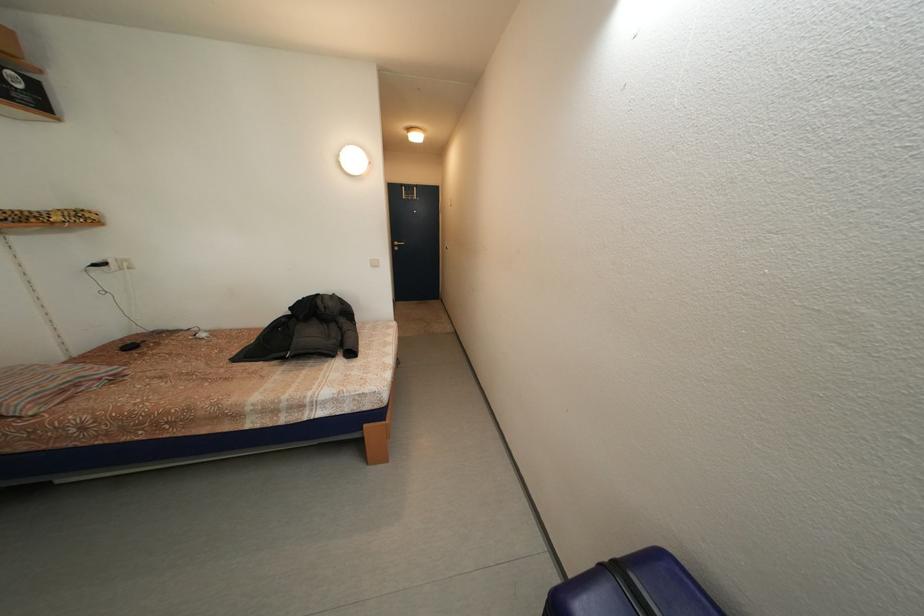
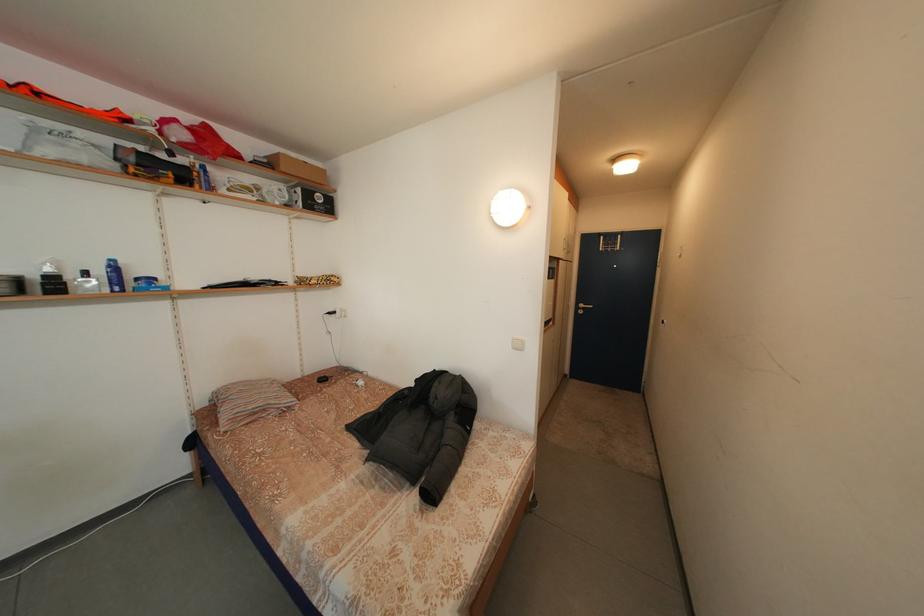
Question: The camera is either moving clockwise (left) or counter-clockwise (right) around the object. The first image is from the beginning of the video and the second image is from the end. Is the camera moving left or right when shooting the video?

Choices:
 (A) Left
 (B) Right

Answer: (B)